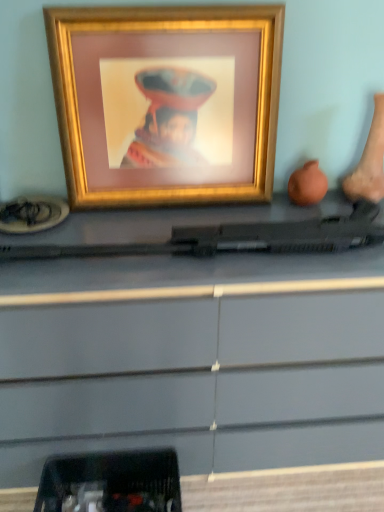
Describe the element at coordinates (192, 359) in the screenshot. I see `matte black gun at center` at that location.

In order to click on matte black gun at center in this screenshot , I will do `click(192, 359)`.

Which object is positioned more to the right, matte black gun at center or gold metallic picture frame at upper center?

Positioned to the right is matte black gun at center.

Can you confirm if matte black gun at center is taller than gold metallic picture frame at upper center?

Indeed, matte black gun at center has a greater height compared to gold metallic picture frame at upper center.

Considering the points (250, 326) and (101, 94), which point is in front, point (250, 326) or point (101, 94)?

The point (250, 326) is closer.

Considering the positions of objects matte black gun at center and gold metallic picture frame at upper center in the image provided, who is behind, matte black gun at center or gold metallic picture frame at upper center?

gold metallic picture frame at upper center.

Could you tell me if matte black gun at center is facing black plastic tray at lower left?

Yes.

Which is in front, matte black gun at center or black plastic tray at lower left?

matte black gun at center is closer to the camera.

Can black plastic tray at lower left be found inside matte black gun at center?

No, black plastic tray at lower left is located outside of matte black gun at center.

From the image's perspective, is matte black gun at center on top of black plastic tray at lower left?

Yes, from the image's perspective, matte black gun at center is over black plastic tray at lower left.

Is gold metallic picture frame at upper center positioned with its back to matte black gun at center?

gold metallic picture frame at upper center is not turned away from matte black gun at center.

How many degrees apart are the facing directions of gold metallic picture frame at upper center and matte black gun at center?

0.104 degrees separate the facing orientations of gold metallic picture frame at upper center and matte black gun at center.

Would you say gold metallic picture frame at upper center contains matte black gun at center?

Definitely not — matte black gun at center is not inside gold metallic picture frame at upper center.

From a real-world perspective, which object rests below the other?

matte black gun at center.

Based on the photo, does gold metallic picture frame at upper center appear on the right side of black plastic tray at lower left?

Indeed, gold metallic picture frame at upper center is positioned on the right side of black plastic tray at lower left.

Considering the relative sizes of gold metallic picture frame at upper center and black plastic tray at lower left in the image provided, is gold metallic picture frame at upper center smaller than black plastic tray at lower left?

Incorrect, gold metallic picture frame at upper center is not smaller in size than black plastic tray at lower left.

Which object is further away from the camera, gold metallic picture frame at upper center or black plastic tray at lower left?

black plastic tray at lower left is behind.

Is gold metallic picture frame at upper center facing away from black plastic tray at lower left?

No, gold metallic picture frame at upper center is not facing away from black plastic tray at lower left.

Could you tell me if black plastic tray at lower left is facing gold metallic picture frame at upper center?

No, black plastic tray at lower left does not turn towards gold metallic picture frame at upper center.

From a real-world perspective, relative to gold metallic picture frame at upper center, is black plastic tray at lower left vertically above or below?

black plastic tray at lower left is below gold metallic picture frame at upper center.

Considering the positions of objects black plastic tray at lower left and gold metallic picture frame at upper center in the image provided, who is more to the left, black plastic tray at lower left or gold metallic picture frame at upper center?

From the viewer's perspective, black plastic tray at lower left appears more on the left side.

The image size is (384, 512). I want to click on equipment below the gold metallic picture frame at upper center (from a real-world perspective), so click(111, 482).

Is black plastic tray at lower left facing away from matte black gun at center?

Yes, black plastic tray at lower left is positioned with its back facing matte black gun at center.

Can you tell me how much black plastic tray at lower left and matte black gun at center differ in facing direction?

black plastic tray at lower left and matte black gun at center are facing 1.73 degrees away from each other.

From the image's perspective, is black plastic tray at lower left under matte black gun at center?

Indeed, from the image's perspective, black plastic tray at lower left is shown beneath matte black gun at center.

Does black plastic tray at lower left have a larger size compared to matte black gun at center?

No.

Identify the location of picture frame behind the matte black gun at center. This screenshot has width=384, height=512. (166, 103).

Find the location of a particular element. desk above the black plastic tray at lower left (from a real-world perspective) is located at coordinates (192, 359).

Looking at the image, which one is located further to matte black gun at center, black plastic tray at lower left or gold metallic picture frame at upper center?

gold metallic picture frame at upper center lies further to matte black gun at center than the other object.

Based on their spatial positions, is matte black gun at center or black plastic tray at lower left closer to gold metallic picture frame at upper center?

Based on the image, matte black gun at center appears to be nearer to gold metallic picture frame at upper center.

Estimate the real-world distances between objects in this image. Which object is closer to black plastic tray at lower left, gold metallic picture frame at upper center or matte black gun at center?

matte black gun at center lies closer to black plastic tray at lower left than the other object.

Which object lies further to the anchor point matte black gun at center, gold metallic picture frame at upper center or black plastic tray at lower left?

The object further to matte black gun at center is gold metallic picture frame at upper center.

When comparing their distances from black plastic tray at lower left, does matte black gun at center or gold metallic picture frame at upper center seem further?

gold metallic picture frame at upper center.

Looking at the image, which one is located further to gold metallic picture frame at upper center, black plastic tray at lower left or matte black gun at center?

The object further to gold metallic picture frame at upper center is black plastic tray at lower left.

Where is `desk between gold metallic picture frame at upper center and black plastic tray at lower left in the up-down direction`? The width and height of the screenshot is (384, 512). desk between gold metallic picture frame at upper center and black plastic tray at lower left in the up-down direction is located at coordinates (192, 359).